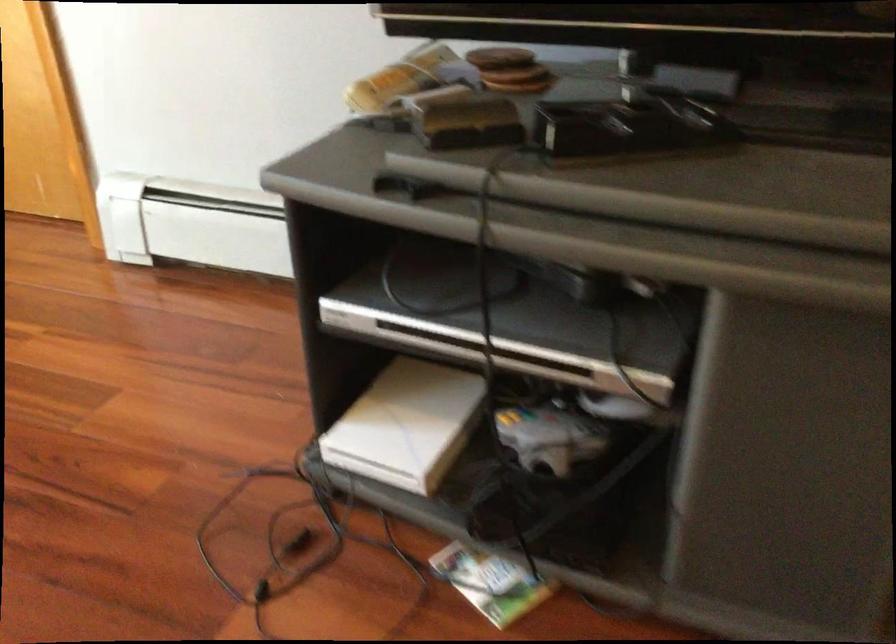
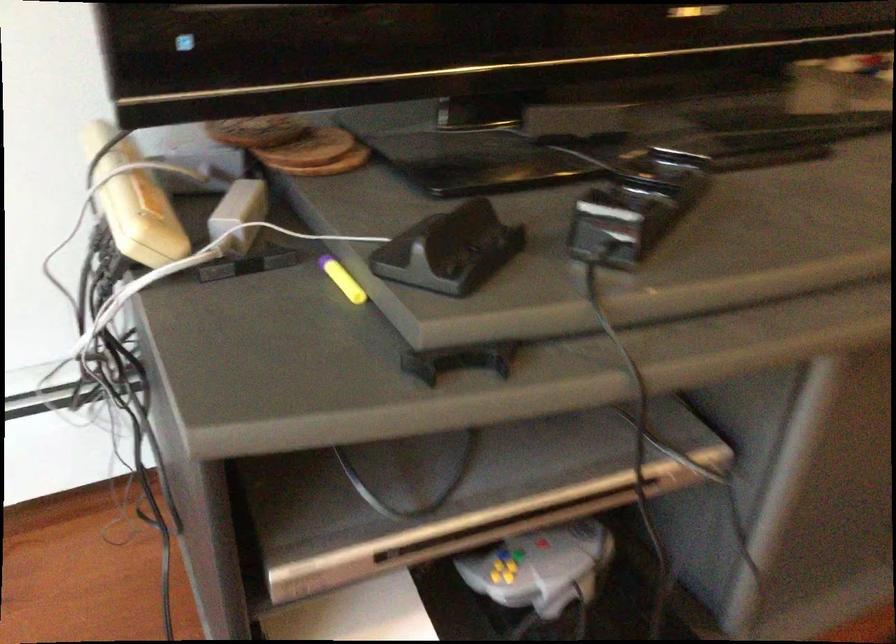
Question: The images are taken continuously from a first-person perspective. In which direction is your viewpoint rotating?

Choices:
 (A) Left
 (B) Right
 (C) Up
 (D) Down

Answer: (B)